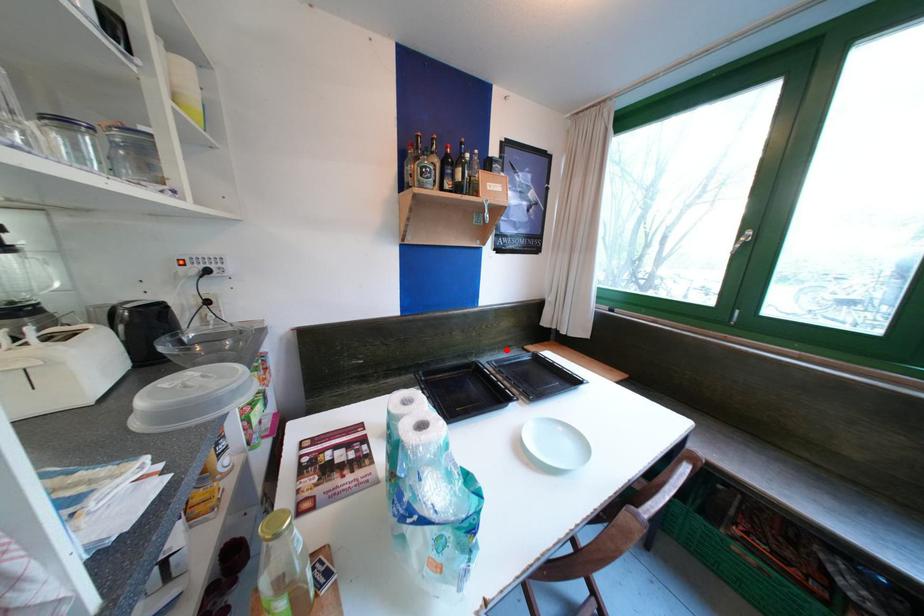
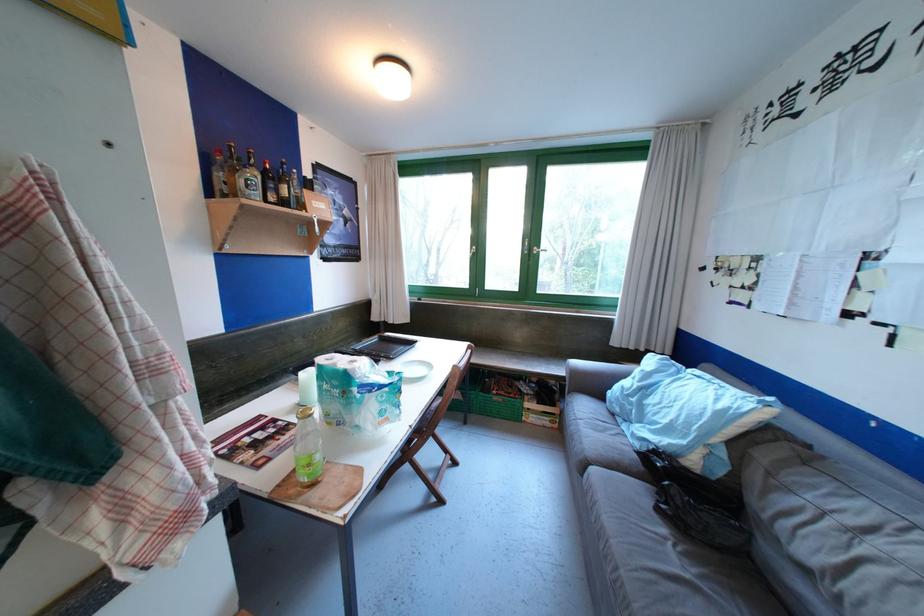
Question: I am providing you with two images of the same scene from different viewpoints. Image1 has a red point marked. In image2, the corresponding 3D location appears at what relative position? Reply with the corresponding letter.

Choices:
 (A) Closer
 (B) Farther

Answer: (B)